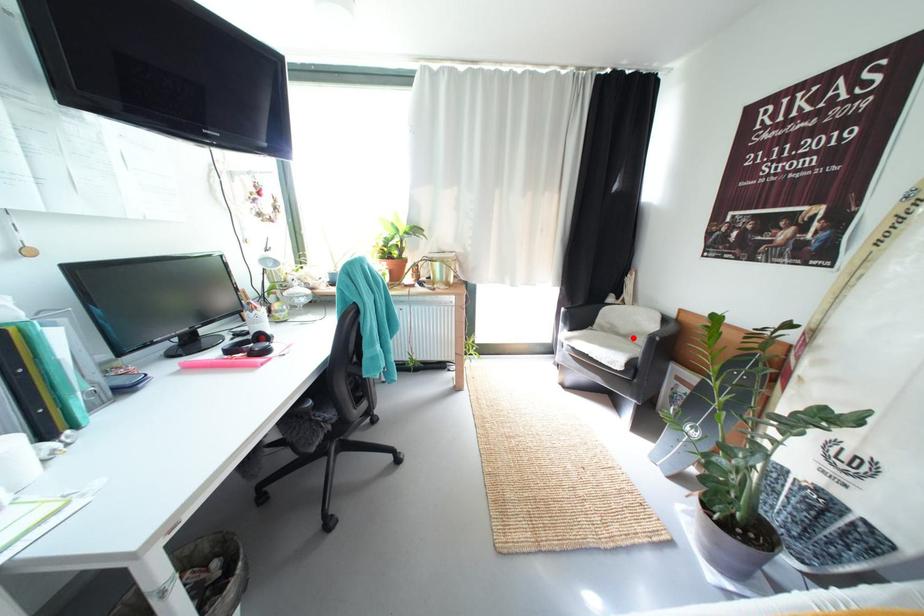
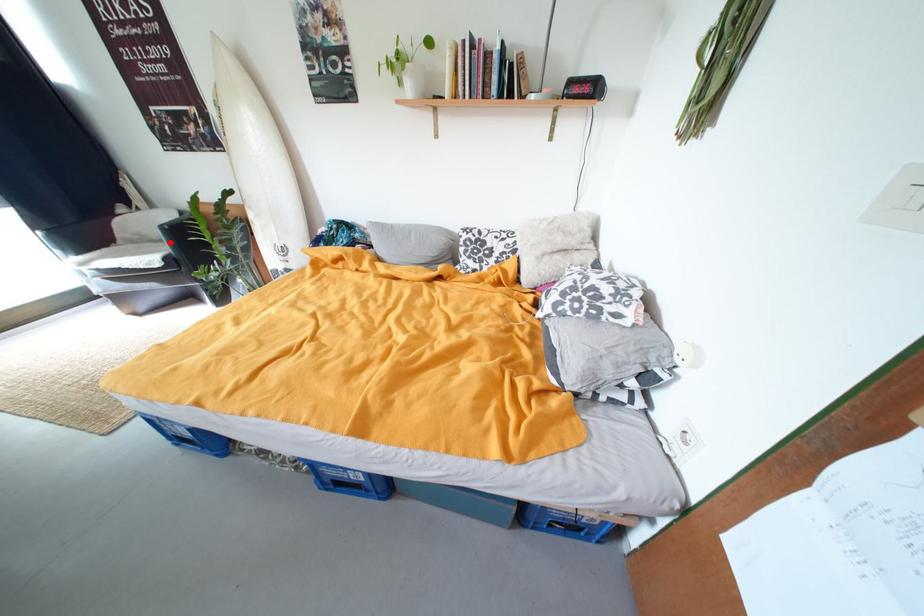
I am providing you with two images of the same scene from different viewpoints. A red point is marked on the first image and another point is marked on the second image. Is the marked point in image1 the same physical position as the marked point in image2?

Yes